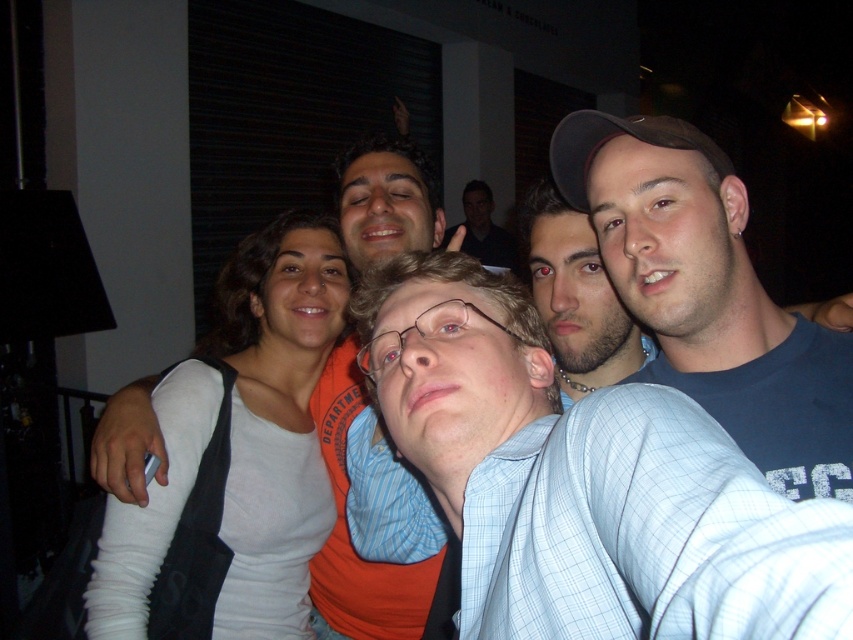
You are holding a camera that has a minimum focusing distance of 12 inches. You want to take a selfie with the light blue plaid shirt at center in focus. Can you do this without moving the camera closer?

The light blue plaid shirt at center and camera are 12.84 inches apart from each other. Since the minimum focusing distance is 12 inches, the camera can focus on the light blue plaid shirt at center because the distance is within the required range.

Looking at this image, based on the scene description, where is the light blue plaid shirt at center located in terms of its 2D coordinates?

The light blue plaid shirt at center is located at the 2D coordinates of point [544,461].